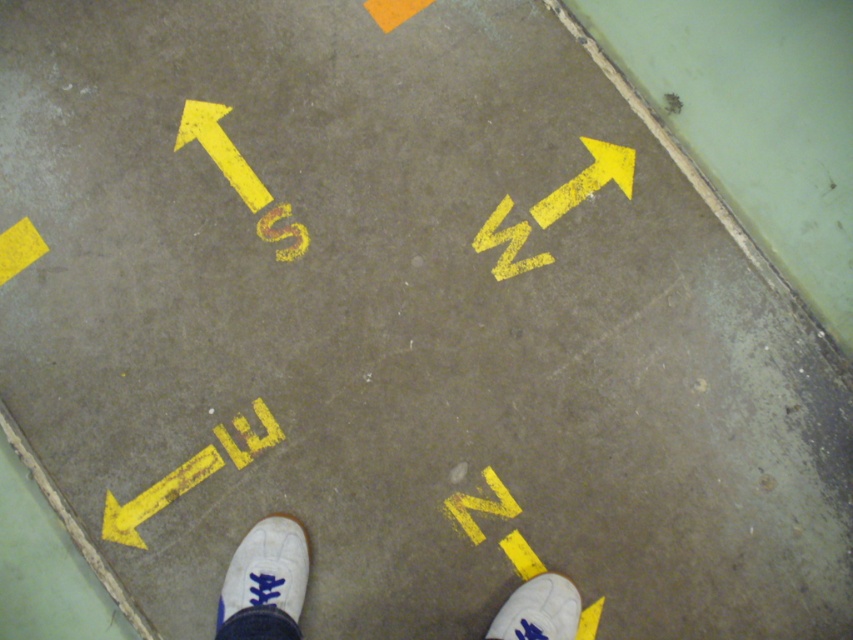
Which of these two, white suede shoe at lower left or white suede shoe at lower right, stands shorter?

white suede shoe at lower right

Does white suede shoe at lower left lie behind white suede shoe at lower right?

No, white suede shoe at lower left is closer to the viewer.

Identify the location of white suede shoe at lower left. (265, 582).

Describe the element at coordinates (265, 582) in the screenshot. I see `white canvas shoe at center` at that location.

Based on the photo, can you confirm if white canvas shoe at center is shorter than white suede shoe at lower left?

Yes.

Describe the element at coordinates (265, 582) in the screenshot. The width and height of the screenshot is (853, 640). I see `white canvas shoe at center` at that location.

What are the coordinates of `white canvas shoe at center` in the screenshot? It's located at (265, 582).

Is white canvas shoe at center shorter than white suede shoe at lower right?

In fact, white canvas shoe at center may be taller than white suede shoe at lower right.

Identify the location of white canvas shoe at center. This screenshot has width=853, height=640. (265, 582).

What do you see at coordinates (265, 582) in the screenshot? This screenshot has height=640, width=853. I see `white canvas shoe at center` at bounding box center [265, 582].

Where is `white canvas shoe at center`? white canvas shoe at center is located at coordinates (265, 582).